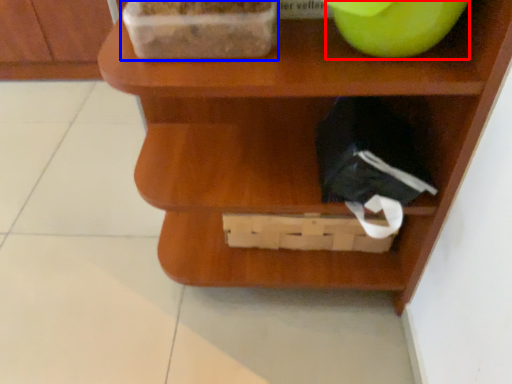
Question: Which of the following is the closest to the observer, apple (highlighted by a red box) or wide (highlighted by a blue box)?

Choices:
 (A) apple
 (B) wide

Answer: (A)